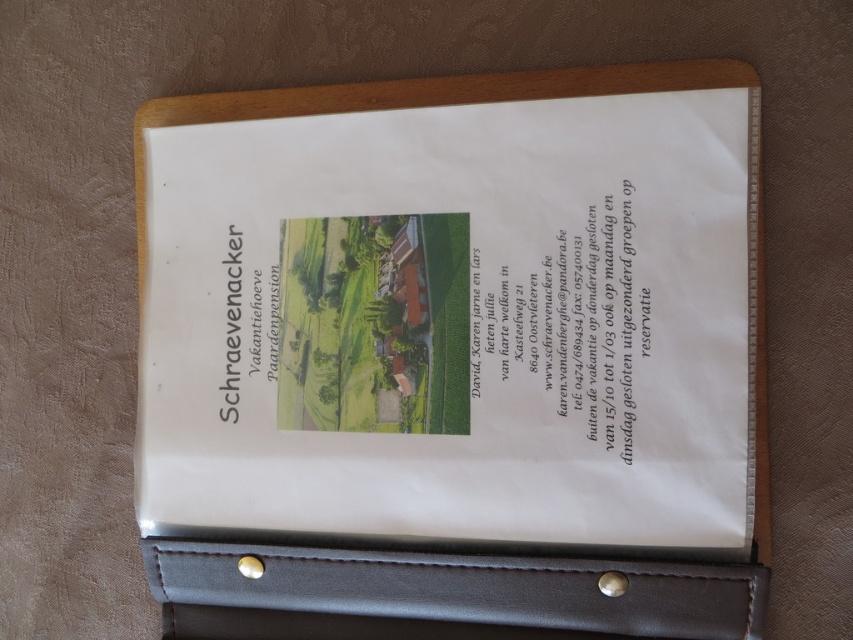
You have a pen that is 5 inches long. You want to draw a line from the white paper at center to the black leather pocket at bottom. Will the pen be long enough to reach the entire distance?

The distance between the white paper at center and the black leather pocket at bottom is 4.79 inches. Since the pen is 5 inches long, it is slightly longer than the required distance. Therefore, the pen will be long enough to reach the entire distance.